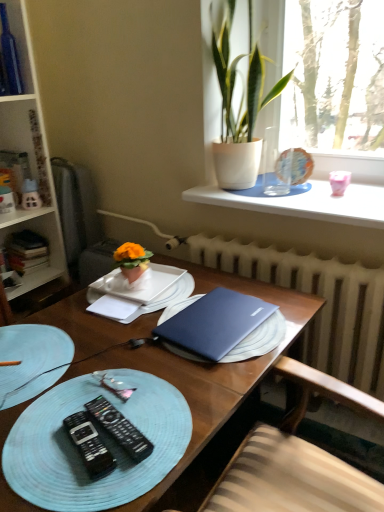
Locate an element on the screen. space that is in front of satin blue laptop at center is located at coordinates click(x=197, y=390).